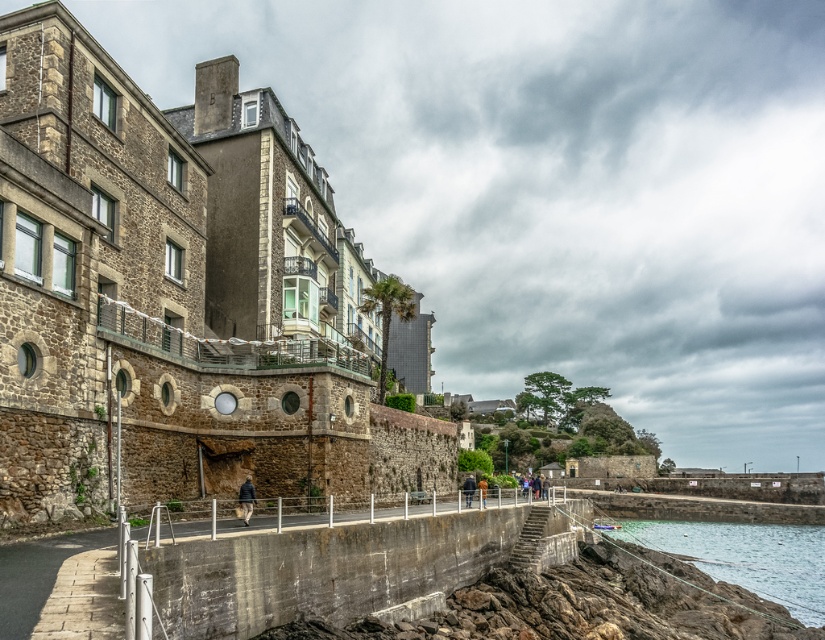
You are standing on the coastal pathway and see a person wearing khaki fabric pants at lower center and a blurred fabric jacket at center. Which piece of clothing is closer to the left side of the jacket?

The khaki fabric pants at lower center is positioned on the left side of blurred fabric jacket at center, so it is closer to the left side of the jacket.

In the scene shown: You are standing on the coastal pathway and want to take a photo of the khaki fabric pants at lower center and the brown leather jacket at center. Which object should you focus on first to ensure both are in clear view?

You should focus on the khaki fabric pants at lower center first since it is closer to the viewer than the brown leather jacket at center, ensuring both are in clear focus when adjusting the camera settings.

You are a photographer trying to capture both the khaki fabric pants at lower center and the brown leather jacket at center in a single frame. Given their sizes, which object would you need to position closer to the camera to ensure both fit within the frame?

Since the khaki fabric pants at lower center occupies less space than the brown leather jacket at center, you should position the khaki fabric pants at lower center closer to the camera to balance their sizes in the frame.